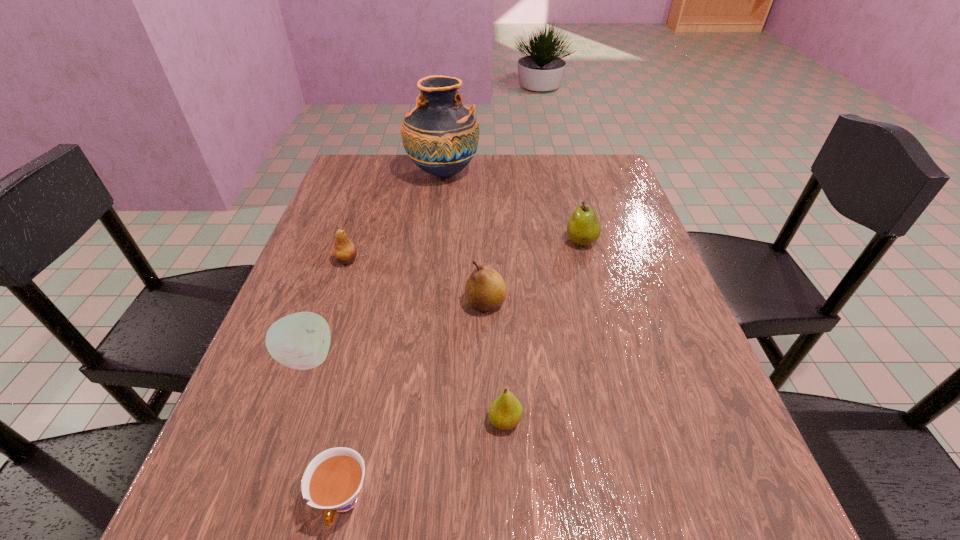
The width and height of the screenshot is (960, 540). I want to click on pottery, so click(x=440, y=135).

At what (x,y) coordinates should I click in order to perform the action: click on the tallest object. Please return your answer as a coordinate pair (x, y). The width and height of the screenshot is (960, 540). Looking at the image, I should click on (440, 135).

Locate an element on the screen. The width and height of the screenshot is (960, 540). the third farthest object is located at coordinates (344, 251).

This screenshot has width=960, height=540. Find the location of `the leftmost pear`. the leftmost pear is located at coordinates (344, 251).

Locate an element on the screen. Image resolution: width=960 pixels, height=540 pixels. the farthest pear is located at coordinates (583, 228).

Where is `the rightmost object`? Image resolution: width=960 pixels, height=540 pixels. the rightmost object is located at coordinates coord(583,228).

Where is `the second nearest pear`? This screenshot has height=540, width=960. the second nearest pear is located at coordinates (485, 290).

Where is `apple`? The width and height of the screenshot is (960, 540). apple is located at coordinates 301,341.

This screenshot has width=960, height=540. What are the coordinates of `the nearest pear` in the screenshot? It's located at (505, 413).

Identify the location of the nearest object. (332, 480).